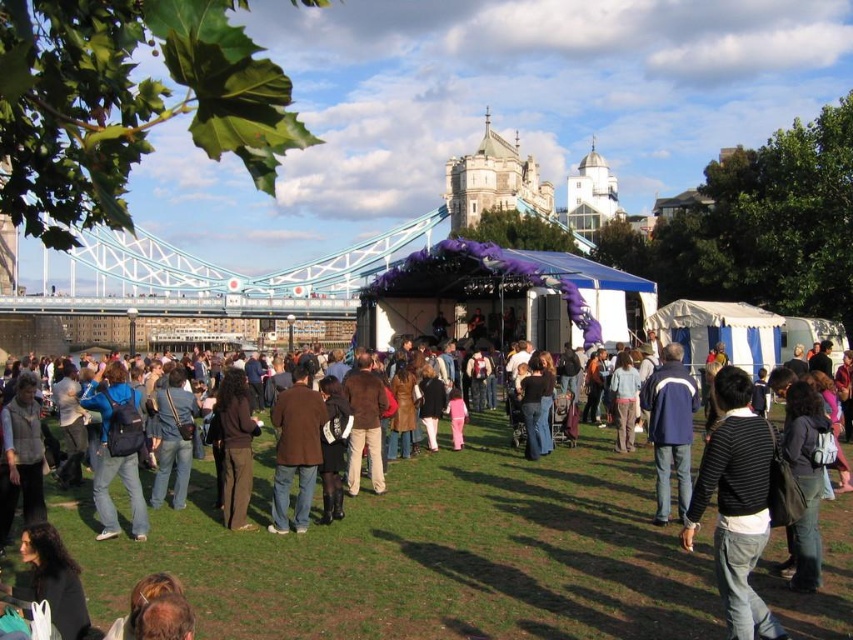
Does brown leather jacket at center appear on the right side of dark brown pants at center?

Indeed, brown leather jacket at center is positioned on the right side of dark brown pants at center.

This screenshot has width=853, height=640. In order to click on brown leather jacket at center in this screenshot , I will do `click(294, 451)`.

Between point (274, 513) and point (248, 499), which one is positioned behind?

The point (248, 499) is behind.

Image resolution: width=853 pixels, height=640 pixels. What are the coordinates of `brown leather jacket at center` in the screenshot? It's located at (294, 451).

Is black striped sweater at lower right to the right of dark brown pants at center from the viewer's perspective?

Correct, you'll find black striped sweater at lower right to the right of dark brown pants at center.

Is black striped sweater at lower right further to camera compared to dark brown pants at center?

No.

Identify the location of black striped sweater at lower right. (735, 502).

Is green grass at center behind blue and white jacket at center?

No, green grass at center is in front of blue and white jacket at center.

Does green grass at center have a smaller size compared to blue and white jacket at center?

No, green grass at center is not smaller than blue and white jacket at center.

Who is more distant from viewer, (550, 593) or (666, 403)?

Point (666, 403)

This screenshot has width=853, height=640. Identify the location of green grass at center. (431, 554).